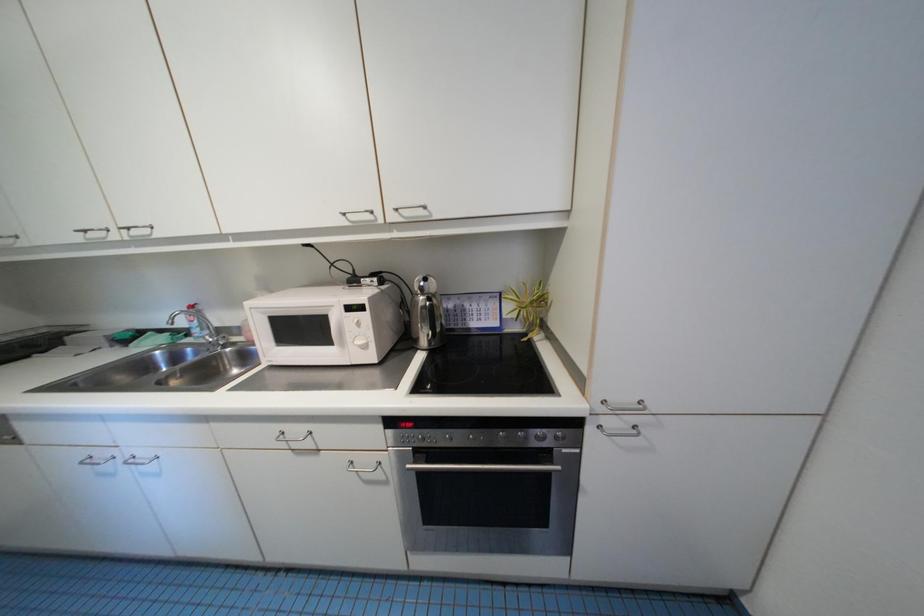
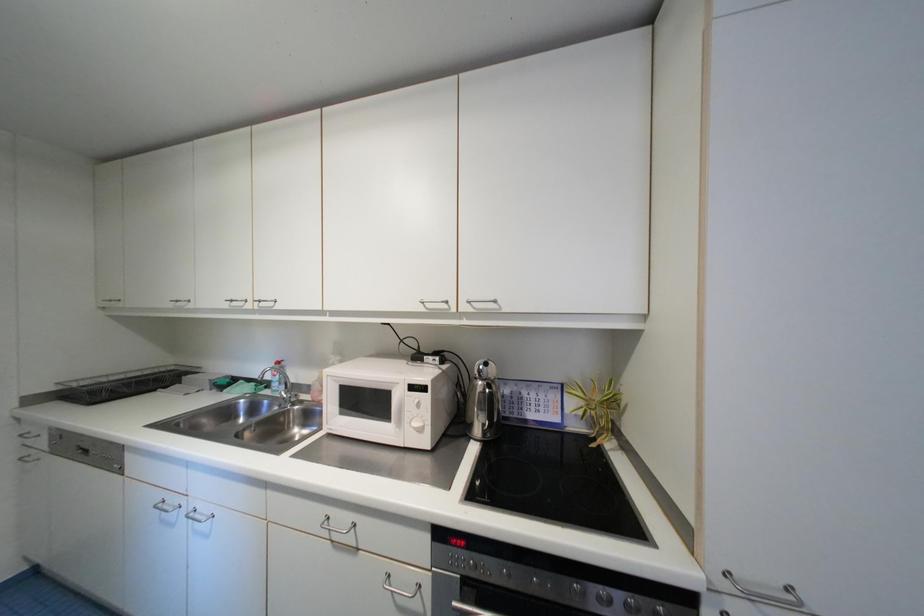
Looking at this image, the images are taken continuously from a first-person perspective. In which direction are you moving?

The movement direction of the cameraman is left, backward.